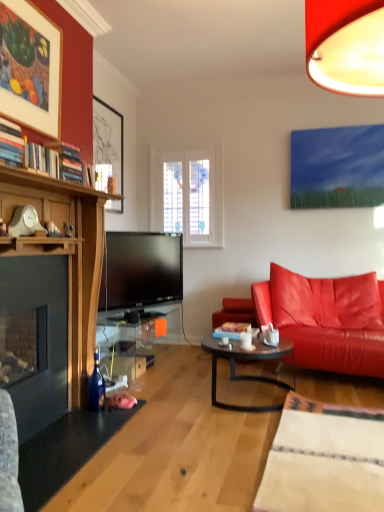
Question: Does leather couch at right lie in front of matte black picture frame at upper left, which is the second picture frame from front to back?

Choices:
 (A) yes
 (B) no

Answer: (A)

Question: From a real-world perspective, is leather couch at right over matte black picture frame at upper left, acting as the 1th picture frame starting from the back?

Choices:
 (A) yes
 (B) no

Answer: (B)

Question: Is leather couch at right positioned with its back to matte black picture frame at upper left, acting as the 1th picture frame starting from the back?

Choices:
 (A) yes
 (B) no

Answer: (B)

Question: Considering the relative sizes of leather couch at right and matte black picture frame at upper left, which is the second picture frame from front to back, in the image provided, is leather couch at right smaller than matte black picture frame at upper left, which is the second picture frame from front to back,?

Choices:
 (A) yes
 (B) no

Answer: (B)

Question: Is leather couch at right not within matte black picture frame at upper left, acting as the 1th picture frame starting from the back?

Choices:
 (A) no
 (B) yes

Answer: (B)

Question: Considering the relative positions of leather couch at right and matte black picture frame at upper left, acting as the 1th picture frame starting from the back, in the image provided, is leather couch at right to the right of matte black picture frame at upper left, acting as the 1th picture frame starting from the back, from the viewer's perspective?

Choices:
 (A) no
 (B) yes

Answer: (B)

Question: Can you confirm if matte wood picture frame at upper left, the second picture frame positioned from the back, is positioned to the right of leather couch at right?

Choices:
 (A) yes
 (B) no

Answer: (B)

Question: Are matte wood picture frame at upper left, which is counted as the 1th picture frame, starting from the front, and leather couch at right making contact?

Choices:
 (A) yes
 (B) no

Answer: (B)

Question: Is matte wood picture frame at upper left, the second picture frame positioned from the back, bigger than leather couch at right?

Choices:
 (A) no
 (B) yes

Answer: (A)

Question: Is matte wood picture frame at upper left, the second picture frame positioned from the back, not close to leather couch at right?

Choices:
 (A) no
 (B) yes

Answer: (B)

Question: Is matte wood picture frame at upper left, the second picture frame positioned from the back, positioned with its back to leather couch at right?

Choices:
 (A) yes
 (B) no

Answer: (B)

Question: Is matte wood picture frame at upper left, the second picture frame positioned from the back, shorter than leather couch at right?

Choices:
 (A) no
 (B) yes

Answer: (B)

Question: Is leather couch at right a part of dark brown glass coffee table at center?

Choices:
 (A) yes
 (B) no

Answer: (B)